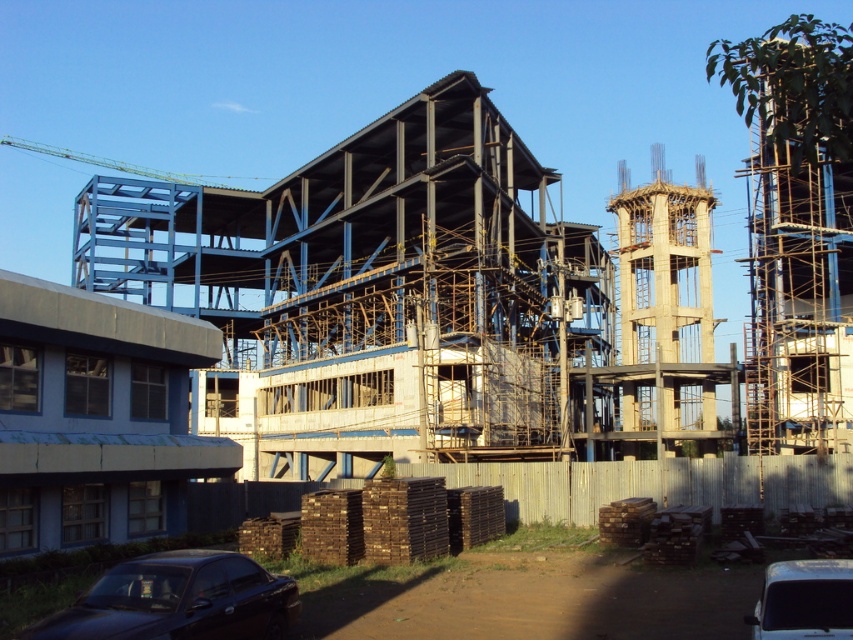
Is shiny black car at lower left taller than metallic blue crane at upper left?

No.

Is shiny black car at lower left to the right of metallic blue crane at upper left from the viewer's perspective?

Correct, you'll find shiny black car at lower left to the right of metallic blue crane at upper left.

What are the coordinates of `shiny black car at lower left` in the screenshot? It's located at (178, 600).

Is white matte van at lower right positioned at the back of metallic blue crane at upper left?

No, white matte van at lower right is in front of metallic blue crane at upper left.

Describe the element at coordinates (804, 600) in the screenshot. The width and height of the screenshot is (853, 640). I see `white matte van at lower right` at that location.

You are a GUI agent. You are given a task and a screenshot of the screen. Output one action in this format:
    pyautogui.click(x=<x>, y=<y>)
    Task: Click on the white matte van at lower right
    Image resolution: width=853 pixels, height=640 pixels.
    Given the screenshot: What is the action you would take?
    pyautogui.click(x=804, y=600)

Does point (264, 627) lie in front of point (799, 628)?

That is False.

Who is shorter, shiny black car at lower left or white matte van at lower right?

With less height is white matte van at lower right.

The width and height of the screenshot is (853, 640). Describe the element at coordinates (178, 600) in the screenshot. I see `shiny black car at lower left` at that location.

You are a GUI agent. You are given a task and a screenshot of the screen. Output one action in this format:
    pyautogui.click(x=<x>, y=<y>)
    Task: Click on the shiny black car at lower left
    The width and height of the screenshot is (853, 640).
    Given the screenshot: What is the action you would take?
    tap(178, 600)